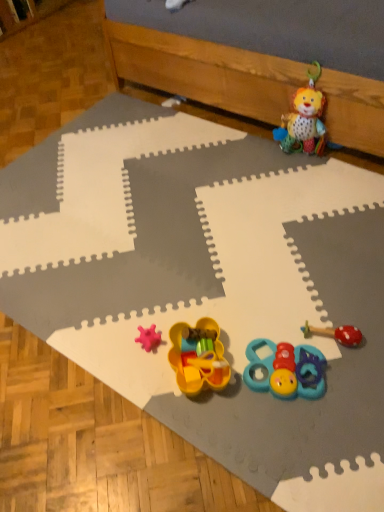
Locate an element on the screen. free region on the left part of yellow plastic toy at center, which is the 4th toy from back to front is located at coordinates (144, 373).